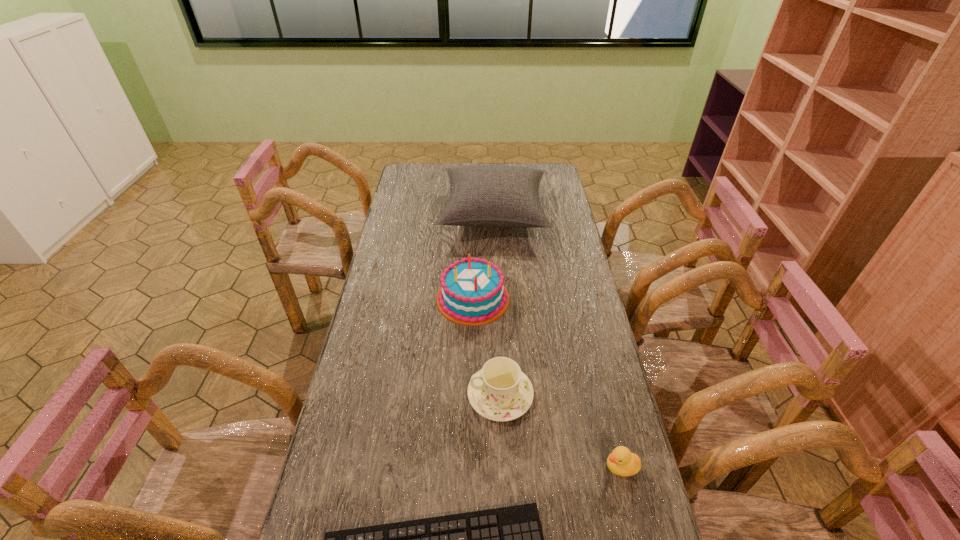
Identify the location of vacant area located 0.280m on the handle side of the chinaware. Image resolution: width=960 pixels, height=540 pixels. (369, 395).

What are the coordinates of `vacant space located 0.240m on the handle side of the chinaware` in the screenshot? It's located at (382, 395).

Where is `vacant space situated on the handle side of the chinaware`? The width and height of the screenshot is (960, 540). vacant space situated on the handle side of the chinaware is located at coordinates (390, 395).

Locate an element on the screen. This screenshot has width=960, height=540. vacant space located on the face of the fourth farthest object is located at coordinates (491, 467).

Identify the location of vacant region located 0.120m on the face of the fourth farthest object. This screenshot has height=540, width=960. (555, 467).

Image resolution: width=960 pixels, height=540 pixels. Find the location of `vacant space located 0.100m on the face of the fourth farthest object`. vacant space located 0.100m on the face of the fourth farthest object is located at coordinates (564, 467).

This screenshot has height=540, width=960. Find the location of `object positioned at the far edge`. object positioned at the far edge is located at coordinates (480, 195).

The width and height of the screenshot is (960, 540). In order to click on cushion that is at the right edge in this screenshot , I will do `click(480, 195)`.

The height and width of the screenshot is (540, 960). I want to click on duckling at the right edge, so click(x=621, y=461).

Locate an element on the screen. The height and width of the screenshot is (540, 960). object situated at the far right corner is located at coordinates (480, 195).